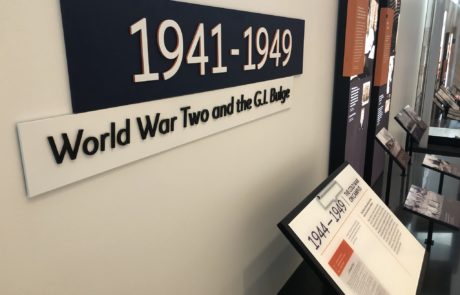
Image resolution: width=460 pixels, height=295 pixels. I want to click on rectangular back sign on wall, so click(x=106, y=63).